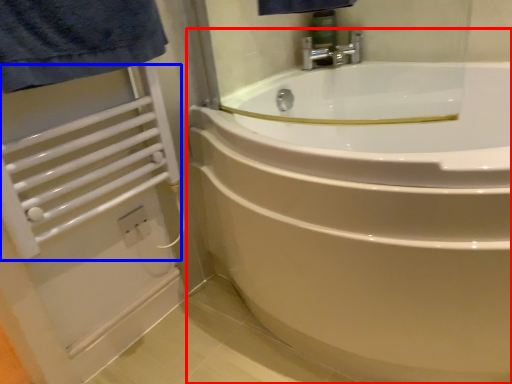
Question: Which object appears closest to the camera in this image, bathtub (highlighted by a red box) or balustrade (highlighted by a blue box)?

Choices:
 (A) bathtub
 (B) balustrade

Answer: (A)